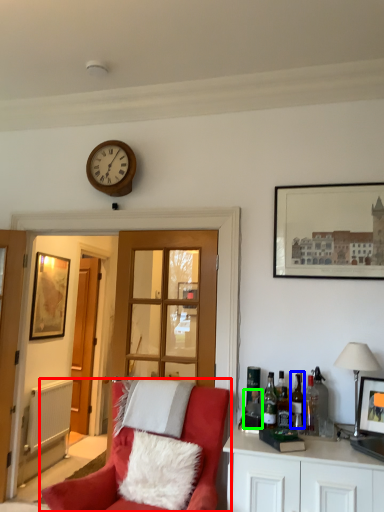
Question: Estimate the real-world distances between objects in this image. Which object is closer to chair (highlighted by a red box), wine bottle (highlighted by a blue box) or bottle (highlighted by a green box)?

Choices:
 (A) wine bottle
 (B) bottle

Answer: (B)